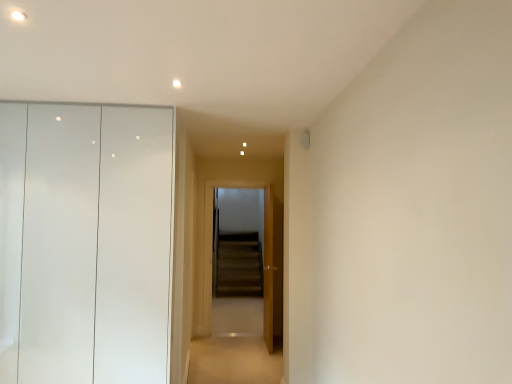
Question: In the image, is wooden door at center positioned in front of or behind matte white dresser at left?

Choices:
 (A) front
 (B) behind

Answer: (B)

Question: Considering the positions of wooden door at center and matte white dresser at left in the image, is wooden door at center bigger or smaller than matte white dresser at left?

Choices:
 (A) small
 (B) big

Answer: (A)

Question: Which of these objects is positioned closest to the wooden door at center?

Choices:
 (A) matte white dresser at left
 (B) carpeted floor at center
 (C) wooden screen door at center

Answer: (B)

Question: Which object is the closest to the wooden screen door at center?

Choices:
 (A) carpeted floor at center
 (B) wooden door at center
 (C) matte white dresser at left

Answer: (A)